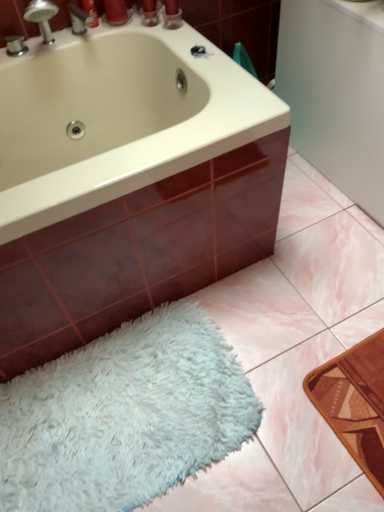
The width and height of the screenshot is (384, 512). What are the coordinates of `vacant space underneath white fluffy bath mat at lower left (from a real-world perspective)` in the screenshot? It's located at 119,418.